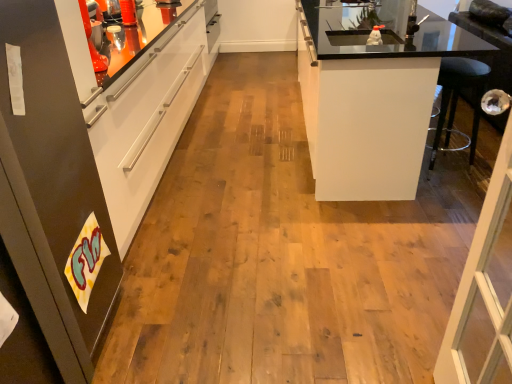
Where is `white glossy cabinet at right, which is the second cabinetry in left-to-right order`? The height and width of the screenshot is (384, 512). white glossy cabinet at right, which is the second cabinetry in left-to-right order is located at coordinates (371, 93).

This screenshot has width=512, height=384. What do you see at coordinates (371, 93) in the screenshot?
I see `white glossy cabinet at right, the second cabinetry from the front` at bounding box center [371, 93].

This screenshot has width=512, height=384. Describe the element at coordinates (87, 155) in the screenshot. I see `matte black refrigerator at left, which is the first cabinetry from left to right` at that location.

This screenshot has height=384, width=512. I want to click on matte black refrigerator at left, arranged as the second cabinetry when viewed from the right, so click(x=87, y=155).

Identify the location of white glossy cabinet at right, which is the second cabinetry in left-to-right order. (371, 93).

Which is more to the right, white glossy cabinet at right, which is the 1th cabinetry from right to left, or matte black refrigerator at left, which appears as the 2th cabinetry when viewed from the back?

white glossy cabinet at right, which is the 1th cabinetry from right to left, is more to the right.

Does white glossy cabinet at right, the second cabinetry from the front, come behind matte black refrigerator at left, arranged as the second cabinetry when viewed from the right?

Yes, the depth of white glossy cabinet at right, the second cabinetry from the front, is greater than that of matte black refrigerator at left, arranged as the second cabinetry when viewed from the right.

Is point (349, 60) closer or farther from the camera than point (42, 229)?

Clearly, point (349, 60) is more distant from the camera than point (42, 229).

From the image's perspective, is white glossy cabinet at right, placed as the first cabinetry when sorted from back to front, located above or below matte black refrigerator at left, which is the first cabinetry from left to right?

From the image's perspective, white glossy cabinet at right, placed as the first cabinetry when sorted from back to front, appears above matte black refrigerator at left, which is the first cabinetry from left to right.

From a real-world perspective, does white glossy cabinet at right, the second cabinetry from the front, stand above matte black refrigerator at left, arranged as the first cabinetry when viewed from the front?

No, from a real-world perspective, white glossy cabinet at right, the second cabinetry from the front, is not over matte black refrigerator at left, arranged as the first cabinetry when viewed from the front

Considering the relative sizes of white glossy cabinet at right, which is the 1th cabinetry from right to left, and matte black refrigerator at left, arranged as the first cabinetry when viewed from the front, in the image provided, is white glossy cabinet at right, which is the 1th cabinetry from right to left, thinner than matte black refrigerator at left, arranged as the first cabinetry when viewed from the front,?

No, white glossy cabinet at right, which is the 1th cabinetry from right to left, is not thinner than matte black refrigerator at left, arranged as the first cabinetry when viewed from the front.

Considering the relative sizes of white glossy cabinet at right, the second cabinetry from the front, and matte black refrigerator at left, which is the first cabinetry from left to right, in the image provided, is white glossy cabinet at right, the second cabinetry from the front, shorter than matte black refrigerator at left, which is the first cabinetry from left to right,?

Yes, white glossy cabinet at right, the second cabinetry from the front, is shorter than matte black refrigerator at left, which is the first cabinetry from left to right.

Looking at the image, does white glossy cabinet at right, which is the 1th cabinetry from right to left, seem bigger or smaller compared to matte black refrigerator at left, arranged as the second cabinetry when viewed from the right?

In the image, white glossy cabinet at right, which is the 1th cabinetry from right to left, appears to be larger than matte black refrigerator at left, arranged as the second cabinetry when viewed from the right.

Do you think white glossy cabinet at right, the second cabinetry from the front, is within matte black refrigerator at left, which appears as the 2th cabinetry when viewed from the back, or outside of it?

The correct answer is: outside.

Are white glossy cabinet at right, the second cabinetry from the front, and matte black refrigerator at left, arranged as the second cabinetry when viewed from the right, located far from each other?

That's right, there is a large distance between white glossy cabinet at right, the second cabinetry from the front, and matte black refrigerator at left, arranged as the second cabinetry when viewed from the right.

Is white glossy cabinet at right, which is the 1th cabinetry from right to left, oriented away from matte black refrigerator at left, arranged as the second cabinetry when viewed from the right?

white glossy cabinet at right, which is the 1th cabinetry from right to left, is not turned away from matte black refrigerator at left, arranged as the second cabinetry when viewed from the right.

At what (x,y) coordinates should I click in order to perform the action: click on cabinetry above the white glossy cabinet at right, which is the second cabinetry in left-to-right order (from a real-world perspective). Please return your answer as a coordinate pair (x, y). The image size is (512, 384). Looking at the image, I should click on (87, 155).

Does matte black refrigerator at left, arranged as the second cabinetry when viewed from the right, appear on the left side of white glossy cabinet at right, the second cabinetry from the front?

Yes.

Which object is closer to the camera, matte black refrigerator at left, which is the first cabinetry from left to right, or white glossy cabinet at right, which is the 1th cabinetry from right to left?

Positioned in front is matte black refrigerator at left, which is the first cabinetry from left to right.

Which is in front, point (13, 110) or point (385, 40)?

The point (13, 110) is closer to the camera.

From the image's perspective, is matte black refrigerator at left, which is the first cabinetry from left to right, located above or below white glossy cabinet at right, the second cabinetry from the front?

matte black refrigerator at left, which is the first cabinetry from left to right, is below white glossy cabinet at right, the second cabinetry from the front.

Based on the photo, from a real-world perspective, is matte black refrigerator at left, arranged as the first cabinetry when viewed from the front, located higher than white glossy cabinet at right, the second cabinetry from the front?

Indeed, from a real-world perspective, matte black refrigerator at left, arranged as the first cabinetry when viewed from the front, stands above white glossy cabinet at right, the second cabinetry from the front.

Which of these two, matte black refrigerator at left, arranged as the second cabinetry when viewed from the right, or white glossy cabinet at right, which is the second cabinetry in left-to-right order, is thinner?

matte black refrigerator at left, arranged as the second cabinetry when viewed from the right.

Can you confirm if matte black refrigerator at left, which appears as the 2th cabinetry when viewed from the back, is taller than white glossy cabinet at right, which is the second cabinetry in left-to-right order?

Yes.

Can you confirm if matte black refrigerator at left, which is the first cabinetry from left to right, is smaller than white glossy cabinet at right, the second cabinetry from the front?

Yes, matte black refrigerator at left, which is the first cabinetry from left to right, is smaller than white glossy cabinet at right, the second cabinetry from the front.

Could white glossy cabinet at right, which is the second cabinetry in left-to-right order, be considered to be inside matte black refrigerator at left, which is the first cabinetry from left to right?

No, white glossy cabinet at right, which is the second cabinetry in left-to-right order, is not inside matte black refrigerator at left, which is the first cabinetry from left to right.

Looking at this image, is matte black refrigerator at left, which is the first cabinetry from left to right, next to white glossy cabinet at right, which is the 1th cabinetry from right to left, and touching it?

No, matte black refrigerator at left, which is the first cabinetry from left to right, is not touching white glossy cabinet at right, which is the 1th cabinetry from right to left.

Is matte black refrigerator at left, which is the first cabinetry from left to right, oriented away from white glossy cabinet at right, which is the second cabinetry in left-to-right order?

No, matte black refrigerator at left, which is the first cabinetry from left to right, is not facing away from white glossy cabinet at right, which is the second cabinetry in left-to-right order.

How different are the orientations of matte black refrigerator at left, arranged as the second cabinetry when viewed from the right, and white glossy cabinet at right, placed as the first cabinetry when sorted from back to front, in degrees?

They differ by 180 degrees in their facing directions.

Measure the distance from matte black refrigerator at left, arranged as the first cabinetry when viewed from the front, to white glossy cabinet at right, which is the 1th cabinetry from right to left.

A distance of 1.26 meters exists between matte black refrigerator at left, arranged as the first cabinetry when viewed from the front, and white glossy cabinet at right, which is the 1th cabinetry from right to left.

This screenshot has height=384, width=512. I want to click on cabinetry that appears above the matte black refrigerator at left, which appears as the 2th cabinetry when viewed from the back (from the image's perspective), so click(x=371, y=93).

The width and height of the screenshot is (512, 384). I want to click on cabinetry located below the white glossy cabinet at right, placed as the first cabinetry when sorted from back to front (from the image's perspective), so click(x=87, y=155).

At what (x,y) coordinates should I click in order to perform the action: click on cabinetry on the right of matte black refrigerator at left, arranged as the second cabinetry when viewed from the right. Please return your answer as a coordinate pair (x, y). The height and width of the screenshot is (384, 512). Looking at the image, I should click on (371, 93).